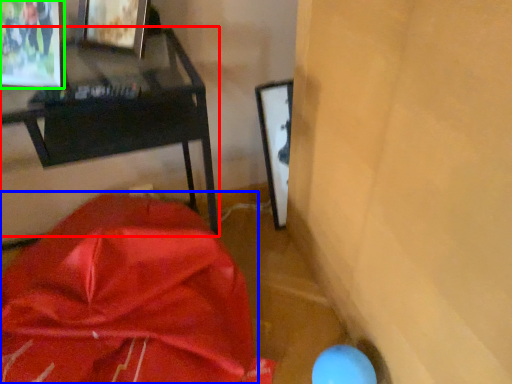
Question: Which object is the closest to the furniture (highlighted by a red box)? Choose among these: wrap (highlighted by a blue box) or picture frame (highlighted by a green box).

Choices:
 (A) wrap
 (B) picture frame

Answer: (B)